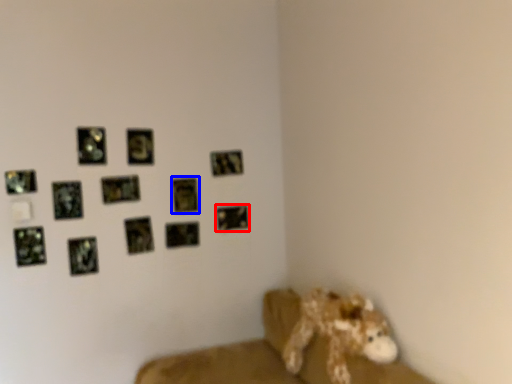
Question: Which of the following is the farthest to the observer, picture frame (highlighted by a red box) or picture frame (highlighted by a blue box)?

Choices:
 (A) picture frame
 (B) picture frame

Answer: (A)